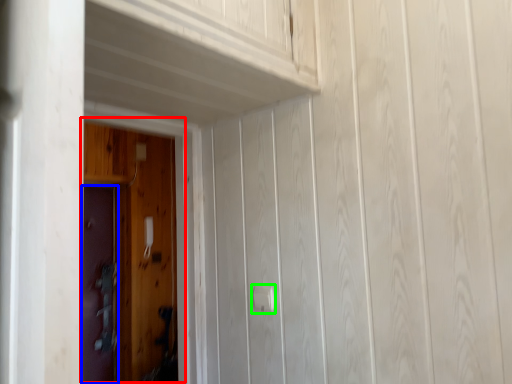
Question: Which is farther away from door (highlighted by a red box)? door (highlighted by a blue box) or door handle (highlighted by a green box)?

Choices:
 (A) door
 (B) door handle

Answer: (B)